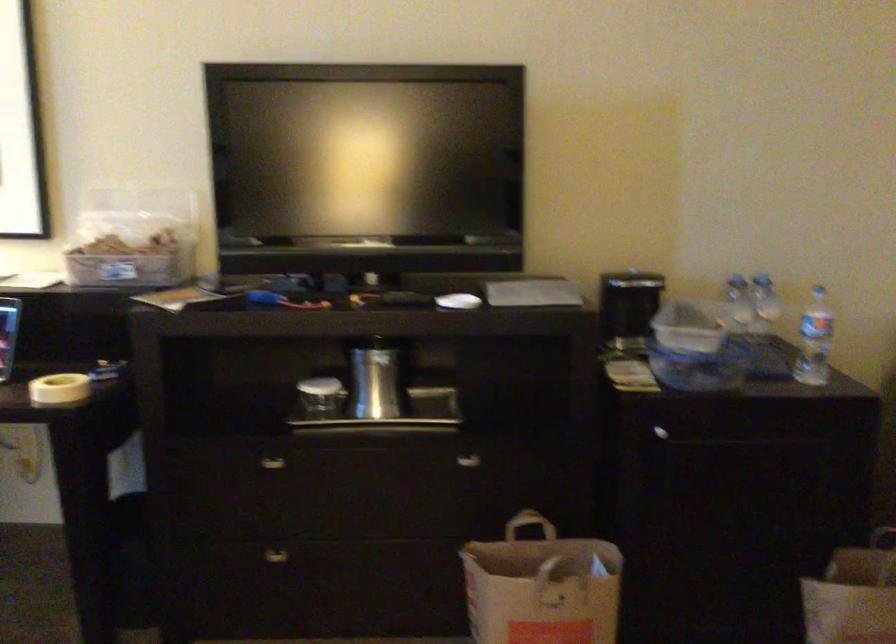
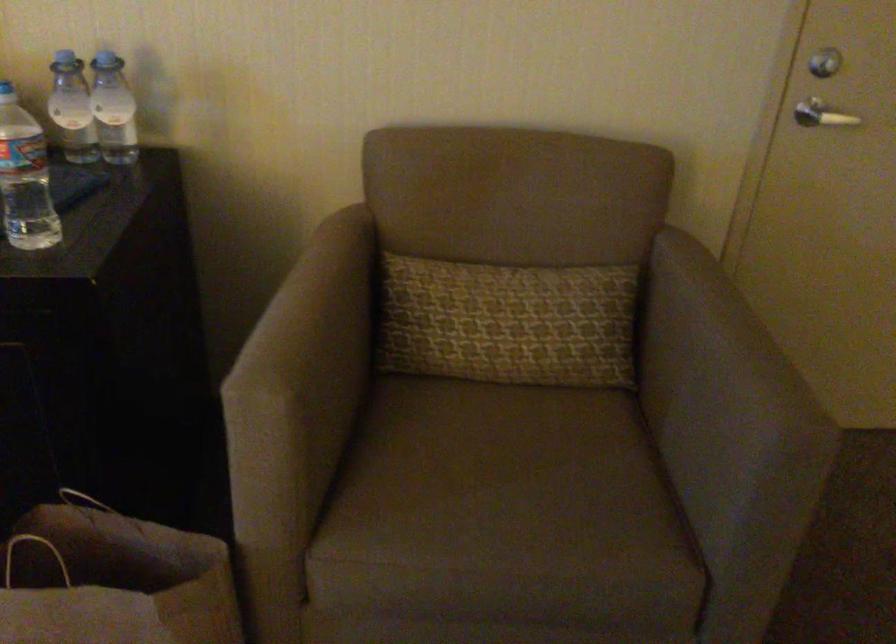
Which direction would the cameraman need to move to produce the second image?

The movement direction of the cameraman is right, forward.